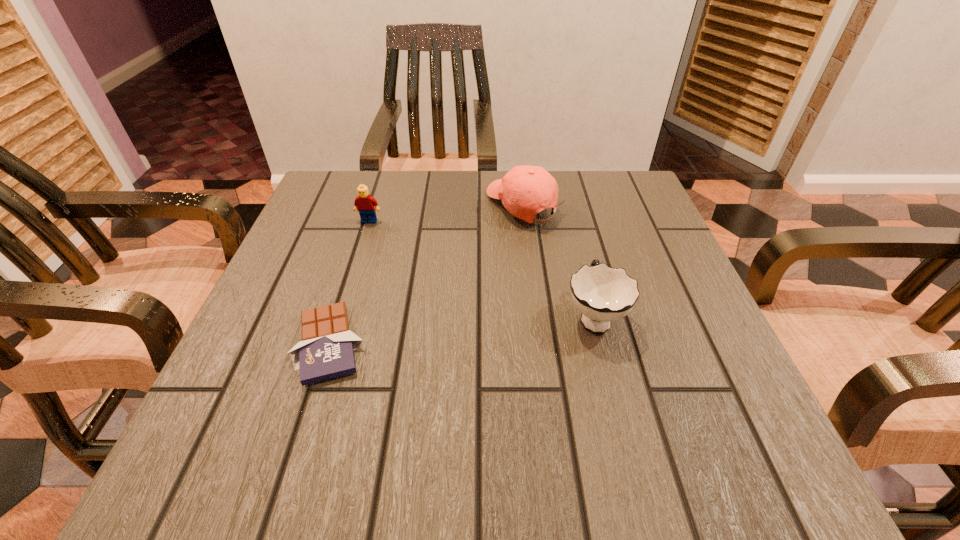
What are the coordinates of `free space between the Lego and the baseball cap` in the screenshot? It's located at (446, 213).

Image resolution: width=960 pixels, height=540 pixels. Find the location of `free spot between the cup and the Lego`. free spot between the cup and the Lego is located at coordinates (481, 268).

Locate an element on the screen. This screenshot has height=540, width=960. the closest object to the Lego is located at coordinates tap(513, 189).

Where is `the third closest object relative to the shortest object`? the third closest object relative to the shortest object is located at coordinates (602, 294).